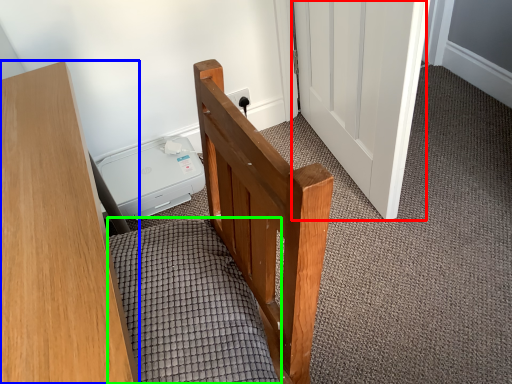
Question: Estimate the real-world distances between objects in this image. Which object is closer to door (highlighted by a red box), furniture (highlighted by a blue box) or bedding (highlighted by a green box)?

Choices:
 (A) furniture
 (B) bedding

Answer: (B)